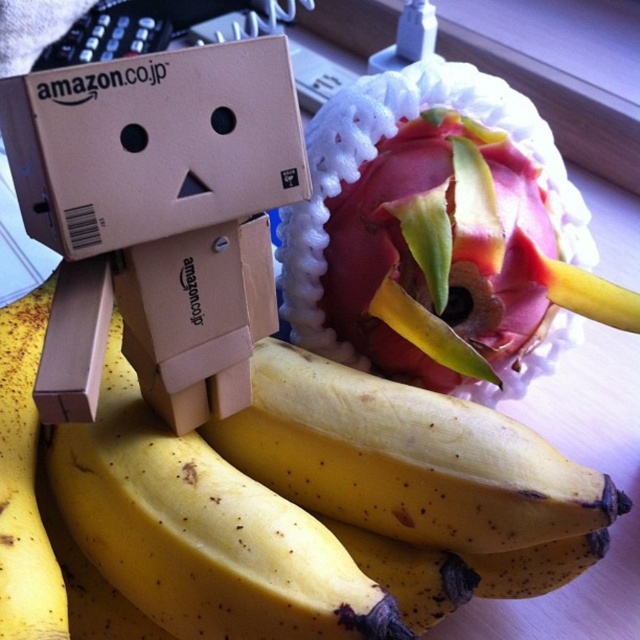
Question: Is yellow matte banana at center wider than pinkish-red flesh with green leaves at center?

Choices:
 (A) no
 (B) yes

Answer: (B)

Question: Which of these objects is positioned closest to the pinkish-red flesh with green leaves at center?

Choices:
 (A) yellow matte banana at center
 (B) brown cardboard box at center

Answer: (A)

Question: Which object appears closest to the camera in this image?

Choices:
 (A) yellow matte banana at center
 (B) brown cardboard box at center

Answer: (B)

Question: Is brown cardboard box at center below pinkish-red flesh with green leaves at center?

Choices:
 (A) no
 (B) yes

Answer: (B)

Question: Among these points, which one is nearest to the camera?

Choices:
 (A) (81, 420)
 (B) (346, 312)
 (C) (525, 538)

Answer: (A)

Question: Is yellow matte banana at center thinner than brown cardboard box at center?

Choices:
 (A) yes
 (B) no

Answer: (B)